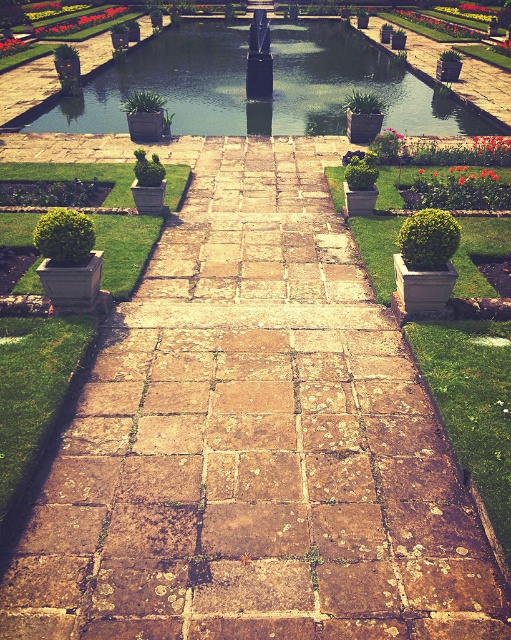
Which is below, green stone waterway at center or green leafy plant at upper left?

Positioned lower is green stone waterway at center.

Who is more distant from viewer, [296,86] or [73,22]?

Point [73,22]

What are the coordinates of `green stone waterway at center` in the screenshot? It's located at (273, 84).

Locate an element on the screen. green stone waterway at center is located at coordinates (273, 84).

Does green stone waterway at center have a larger size compared to red glossy tulip at center?

Yes.

You are a GUI agent. You are given a task and a screenshot of the screen. Output one action in this format:
    pyautogui.click(x=<x>, y=<y>)
    Task: Click on the green stone waterway at center
    Image resolution: width=511 pixels, height=640 pixels.
    Given the screenshot: What is the action you would take?
    pyautogui.click(x=273, y=84)

Is green stone waterway at center thinner than vivid red petals at center?

No, green stone waterway at center is not thinner than vivid red petals at center.

Is point (485, 129) positioned behind point (481, 145)?

Yes, it is.

Where is `green stone waterway at center`? The height and width of the screenshot is (640, 511). green stone waterway at center is located at coordinates (273, 84).